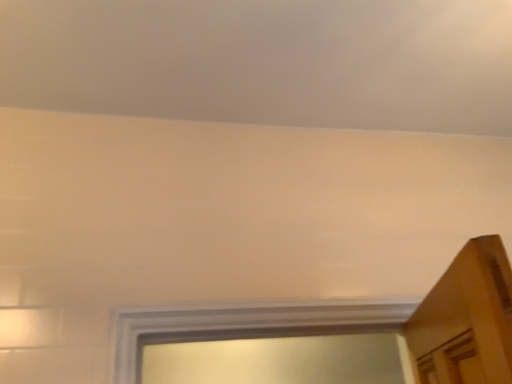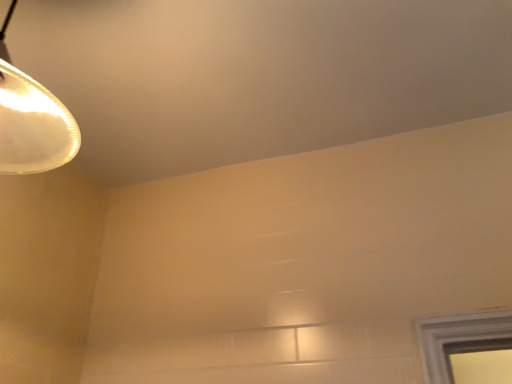
Question: How did the camera likely rotate when shooting the video?

Choices:
 (A) rotated left
 (B) rotated right

Answer: (A)